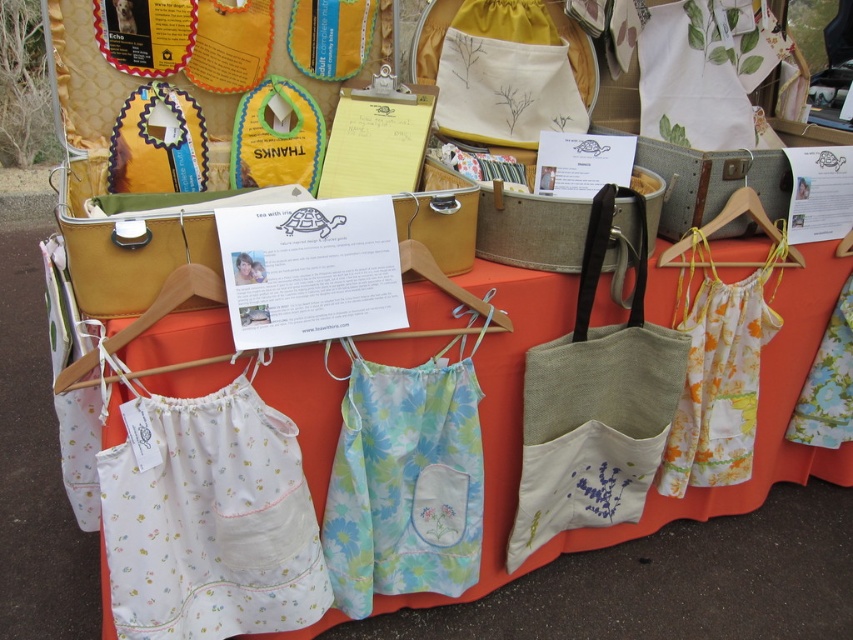
What do you see at coordinates (209, 518) in the screenshot? I see `white cotton apron at lower left` at bounding box center [209, 518].

Is point (193, 397) behind point (561, 429)?

That is False.

At what (x,y) coordinates should I click in order to perform the action: click on white cotton apron at lower left. Please return your answer as a coordinate pair (x, y). The image size is (853, 640). Looking at the image, I should click on (209, 518).